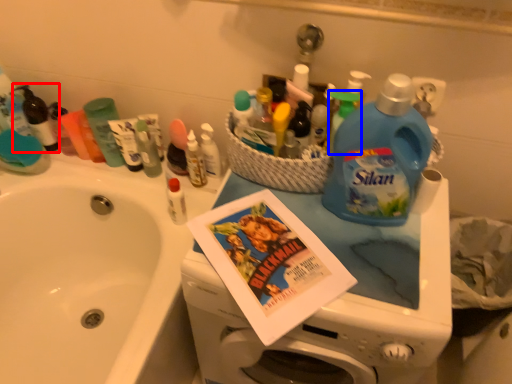
Question: Which point is closer to the camera, toiletry (highlighted by a red box) or cleaning product (highlighted by a blue box)?

Choices:
 (A) toiletry
 (B) cleaning product

Answer: (B)